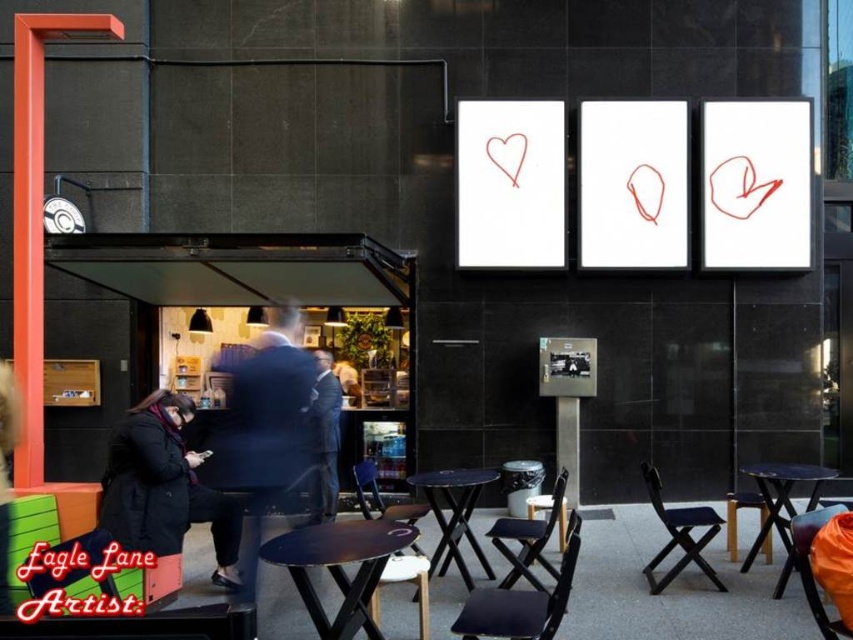
You are standing at the entrance of the doorway on the left side of the urban outdoor seating area. You want to walk to the point labeled as point (x=672, y=544). Will you be able to see the point labeled as point (x=291, y=346) from your current position?

Since point (x=291, y=346) is behind point (x=672, y=544), you will not be able to see point (x=291, y=346) from your current position as it is obscured by point (x=672, y=544).

You are a tailor who needs to store a black suit at center and a black fabric chair at lower right in a storage room. The storage room has a narrow doorway that only allows items narrower than 1 meter to pass through. Can both items fit through the doorway?

The black suit at center is wider than the black fabric chair at lower right. Since the doorway only allows items narrower than 1 meter, you need to check each item individually. If the black fabric chair at lower right is under 1 meter in width, it can pass through. However, the black suit at center, being wider, might exceed the 1 meter limit and cannot pass through unless folded.

You are standing in the urban outdoor seating area and want to reach the point marked at coordinates (801, 472). Given that the distance from your current position to this point is 6.25 meters, can you estimate how far you need to walk to reach it?

The point at coordinates (801, 472) is 6.25 meters away from your current position, so you need to walk approximately 6.25 meters to reach it.